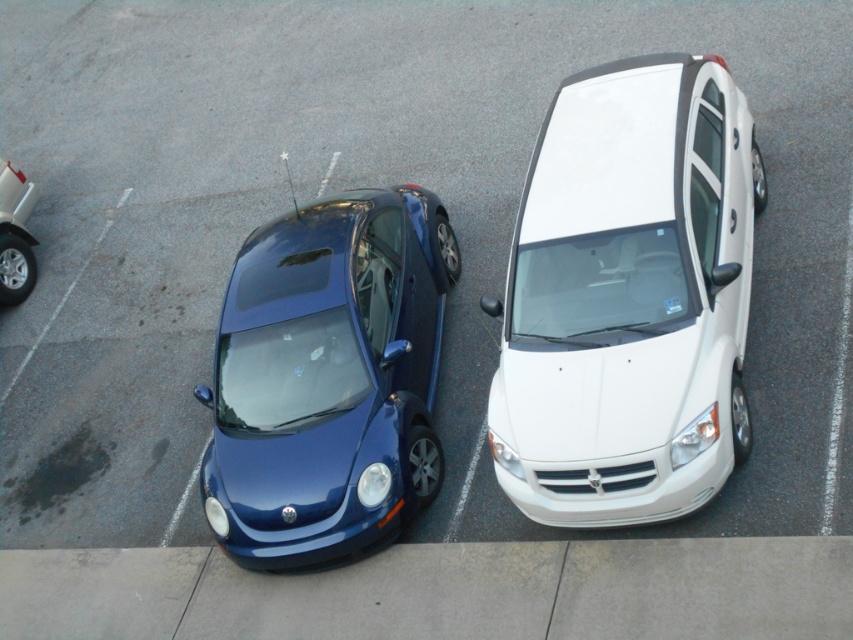
Is point (619, 314) positioned before point (18, 236)?

Yes, point (619, 314) is closer to viewer.

Does white glossy van at upper right come in front of metallic blue car at center?

Yes, white glossy van at upper right is in front of metallic blue car at center.

What do you see at coordinates (630, 298) in the screenshot? I see `white glossy van at upper right` at bounding box center [630, 298].

Image resolution: width=853 pixels, height=640 pixels. Identify the location of white glossy van at upper right. (630, 298).

Between glossy blue car at center and metallic blue car at center, which one has less height?

Standing shorter between the two is metallic blue car at center.

Does glossy blue car at center have a smaller size compared to metallic blue car at center?

Actually, glossy blue car at center might be larger than metallic blue car at center.

Where is `glossy blue car at center`? This screenshot has width=853, height=640. glossy blue car at center is located at coordinates (328, 378).

Can you confirm if white glossy van at upper right is wider than glossy blue car at center?

Yes, white glossy van at upper right is wider than glossy blue car at center.

The width and height of the screenshot is (853, 640). What do you see at coordinates (630, 298) in the screenshot?
I see `white glossy van at upper right` at bounding box center [630, 298].

Locate an element on the screen. white glossy van at upper right is located at coordinates (630, 298).